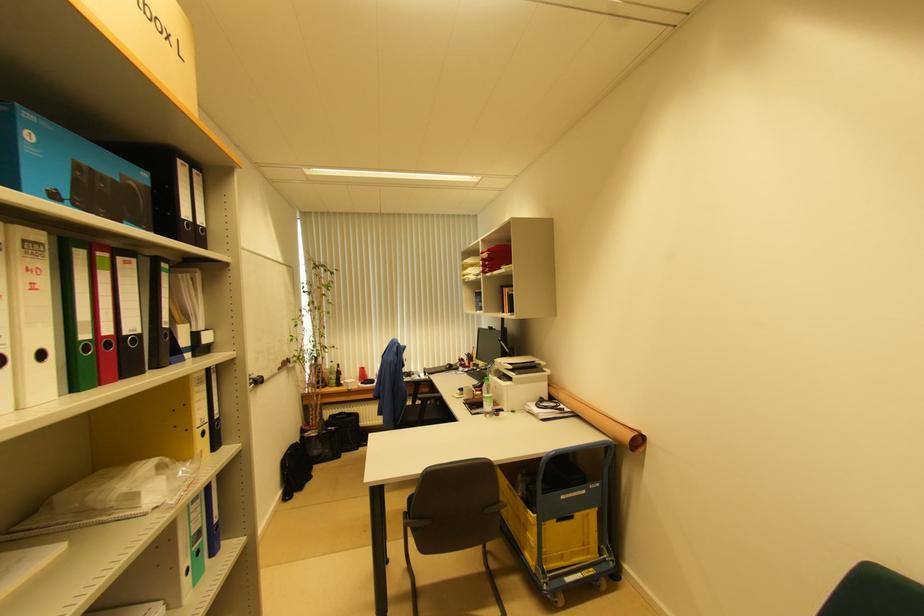
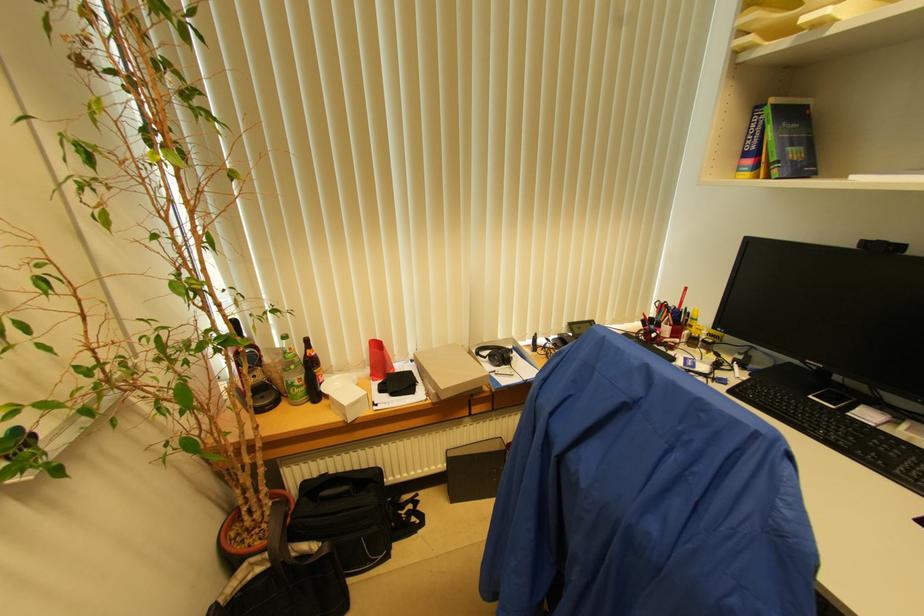
Question: The images are taken continuously from a first-person perspective. In which direction are you moving?

Choices:
 (A) Left
 (B) Right
 (C) Forward
 (D) Backward

Answer: (C)